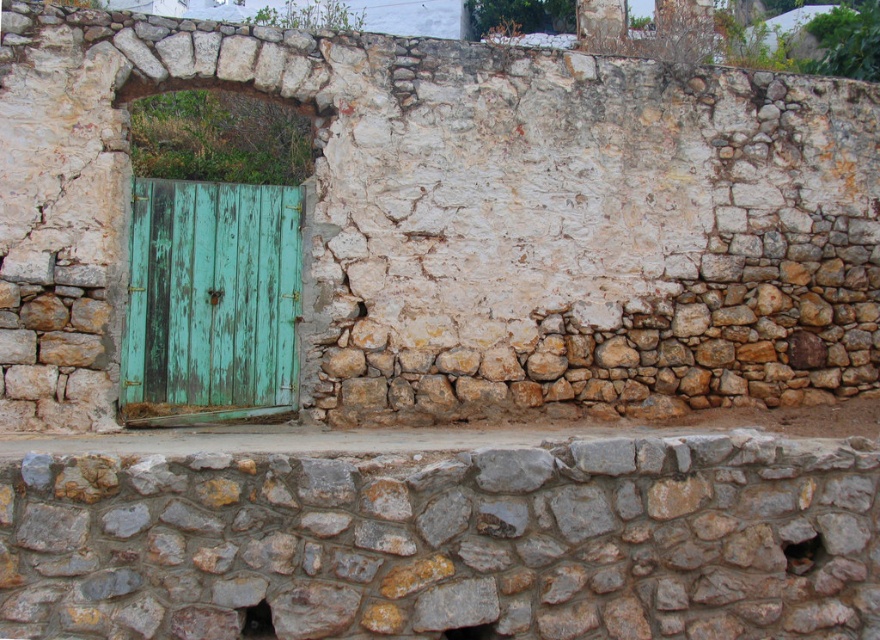
You are standing in front of the rustic stone wall at center and the green weathered wood door at left. Which object is taller?

The green weathered wood door at left is taller than the rustic stone wall at center.

You are standing in front of the rustic stone wall with the green door. There are two points marked on the wall at coordinates point (57, 481) and point (295, 193). Which point is closer to you?

Point (57, 481) is closer to the camera than point (295, 193), so the point closer to you is point (57, 481).

You are standing in front of the rustic stone wall at center and the green weathered wood door at left. Which object is nearer to you?

The rustic stone wall at center is closer to the viewer than the green weathered wood door at left, so the rustic stone wall at center is nearer to you.